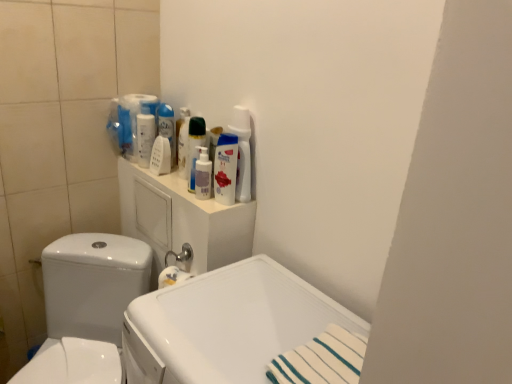
I want to click on vacant area that is in front of white glossy bottle at upper center, acting as the 2th cleaning product starting from the left, so click(182, 190).